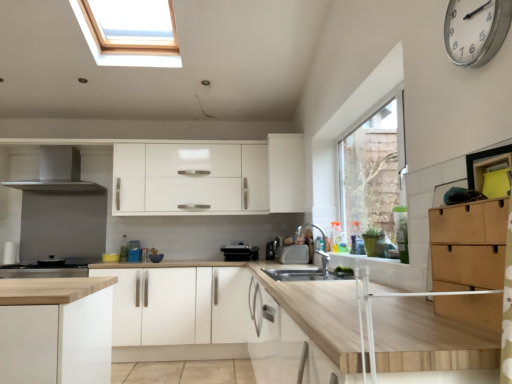
Question: Is black plastic toaster at center, which appears as the 1th appliance when viewed from the back, smaller than white metallic clock at upper right?

Choices:
 (A) yes
 (B) no

Answer: (B)

Question: Is the position of black plastic toaster at center, which is the 1th appliance from left to right, less distant than that of white metallic clock at upper right?

Choices:
 (A) no
 (B) yes

Answer: (A)

Question: Is black plastic toaster at center, the third appliance positioned from the right, oriented towards white metallic clock at upper right?

Choices:
 (A) no
 (B) yes

Answer: (B)

Question: Is black plastic toaster at center, which appears as the 3th appliance when viewed from the front, far away from white metallic clock at upper right?

Choices:
 (A) no
 (B) yes

Answer: (B)

Question: From the image's perspective, is black plastic toaster at center, which appears as the 3th appliance when viewed from the front, on white metallic clock at upper right?

Choices:
 (A) no
 (B) yes

Answer: (A)

Question: Is light brown wood drawer at right, the third cabinetry in the back-to-front sequence, wider or thinner than satin silver metallic range hood at upper left, acting as the 2th home appliance starting from the bottom?

Choices:
 (A) wide
 (B) thin

Answer: (B)

Question: Is light brown wood drawer at right, which is the 1th cabinetry from front to back, in front of or behind satin silver metallic range hood at upper left, acting as the 2th home appliance starting from the bottom, in the image?

Choices:
 (A) behind
 (B) front

Answer: (B)

Question: From a real-world perspective, is light brown wood drawer at right, acting as the 2th cabinetry starting from the top, positioned above or below satin silver metallic range hood at upper left, acting as the 2th home appliance starting from the bottom?

Choices:
 (A) above
 (B) below

Answer: (B)

Question: From the image's perspective, is light brown wood drawer at right, the first cabinetry from the right, above or below satin silver metallic range hood at upper left, acting as the first home appliance starting from the top?

Choices:
 (A) above
 (B) below

Answer: (B)

Question: From the image's perspective, is silver metallic faucet at center above or below white matte cabinet at upper center, placed as the second cabinetry when sorted from right to left?

Choices:
 (A) below
 (B) above

Answer: (A)

Question: In terms of height, does silver metallic faucet at center look taller or shorter compared to white matte cabinet at upper center, placed as the second cabinetry when sorted from right to left?

Choices:
 (A) tall
 (B) short

Answer: (B)

Question: Is point (321, 258) closer or farther from the camera than point (273, 165)?

Choices:
 (A) farther
 (B) closer

Answer: (B)

Question: Is silver metallic faucet at center to the left or to the right of white matte cabinet at upper center, placed as the second cabinetry when sorted from right to left, in the image?

Choices:
 (A) left
 (B) right

Answer: (B)

Question: From the image's perspective, relative to white matte cabinet at upper center, which is the second cabinetry in left-to-right order, is white matte cabinet at center, which is the second cabinetry in back-to-front order, above or below?

Choices:
 (A) above
 (B) below

Answer: (B)

Question: Is white matte cabinet at center, which is the second cabinetry in back-to-front order, inside the boundaries of white matte cabinet at upper center, the 1th cabinetry when ordered from top to bottom, or outside?

Choices:
 (A) inside
 (B) outside

Answer: (B)